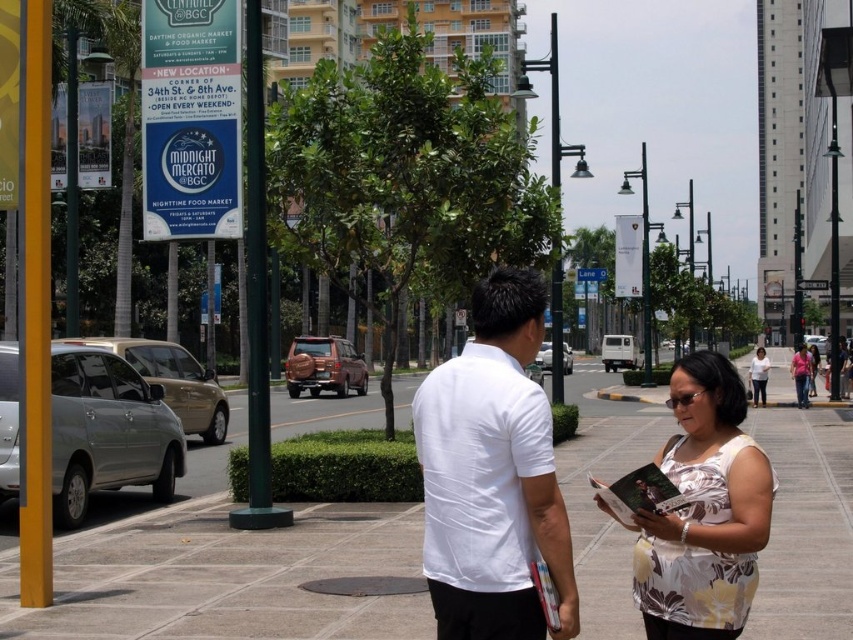
Looking at this image, does white matte shirt at center appear on the right side of blue plastic sign at center?

No, white matte shirt at center is not to the right of blue plastic sign at center.

Looking at this image, does white matte shirt at center come in front of blue plastic sign at center?

Yes, it is in front of blue plastic sign at center.

Locate an element on the screen. The height and width of the screenshot is (640, 853). white matte shirt at center is located at coordinates (492, 474).

Is point (485, 532) behind point (704, 419)?

No, (485, 532) is in front of (704, 419).

Find the location of a particular element. The height and width of the screenshot is (640, 853). white matte shirt at center is located at coordinates (492, 474).

The width and height of the screenshot is (853, 640). Describe the element at coordinates (704, 509) in the screenshot. I see `white floral tank top at right` at that location.

Does white floral tank top at right have a smaller size compared to floral print blouse at center?

Yes, white floral tank top at right is smaller than floral print blouse at center.

Locate an element on the screen. This screenshot has width=853, height=640. white floral tank top at right is located at coordinates (704, 509).